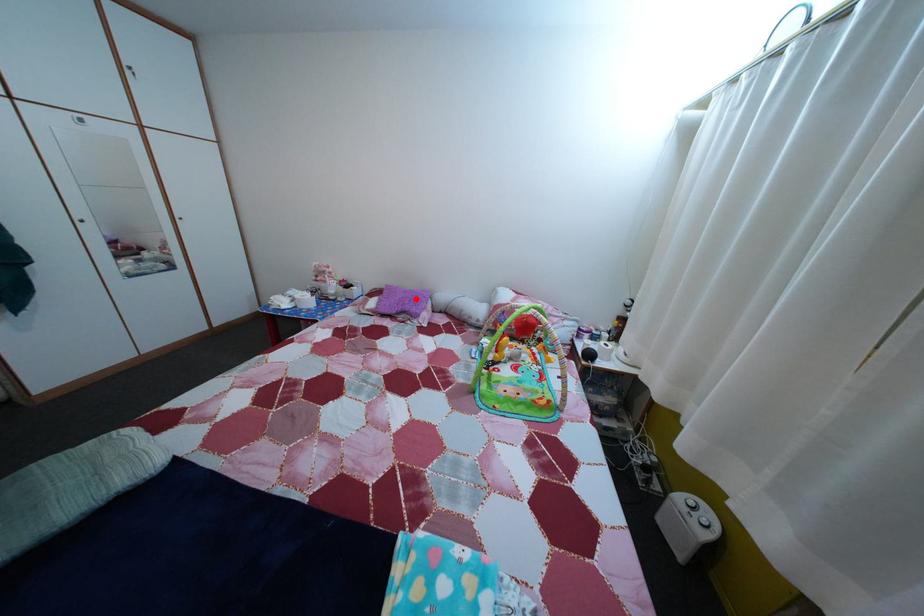
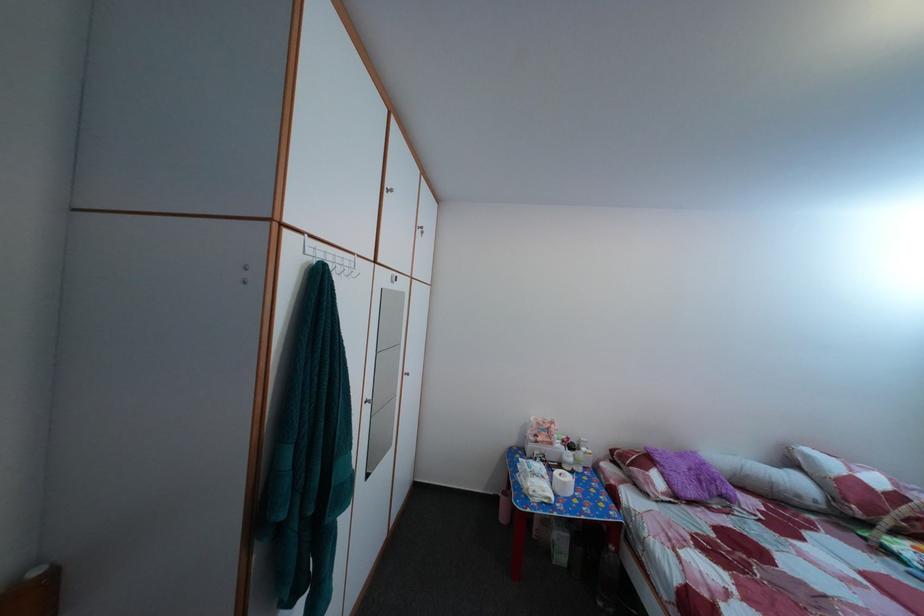
Find the pixel in the second image that matches the highlighted location in the first image.

(689, 464)